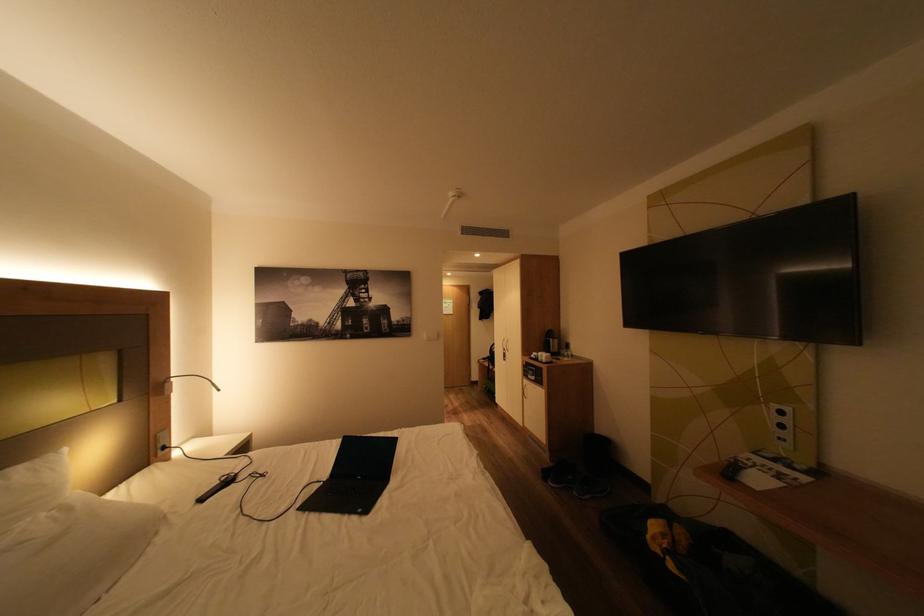
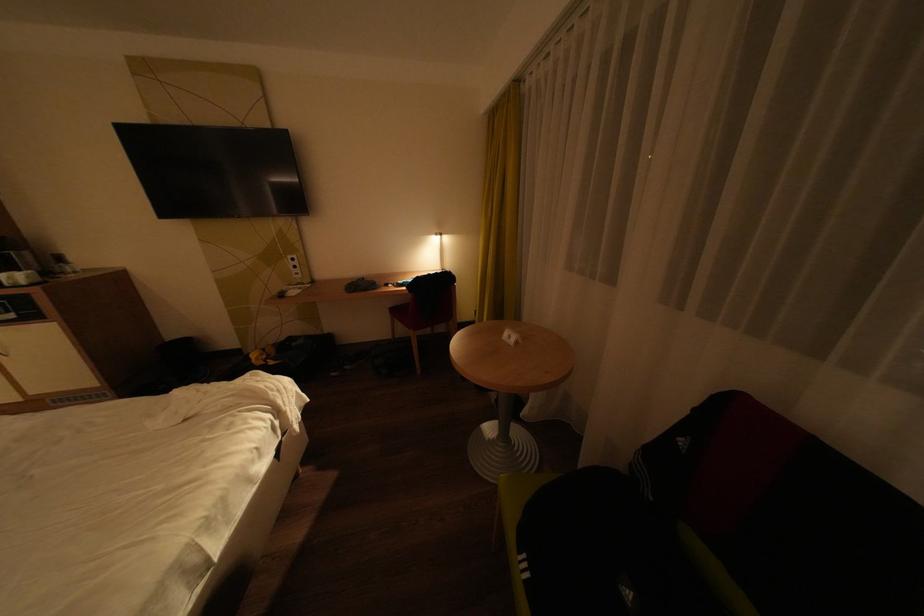
In the scene shown: The images are taken continuously from a first-person perspective. In which direction is your viewpoint rotating?

The camera rotated toward right-down.